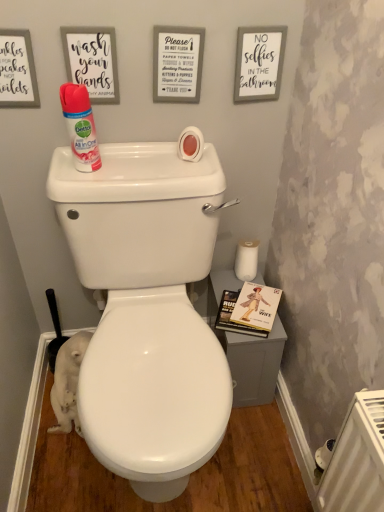
Question: Could white paper sign at upper center, marked as the second copy in a right-to-left arrangement, be considered to be inside matte white sign at upper left, the 3th copy from the right?

Choices:
 (A) no
 (B) yes

Answer: (A)

Question: Considering the relative sizes of matte white sign at upper left, the 2th copy positioned from the left, and white paper sign at upper center, marked as the second copy in a right-to-left arrangement, in the image provided, is matte white sign at upper left, the 2th copy positioned from the left, smaller than white paper sign at upper center, marked as the second copy in a right-to-left arrangement,?

Choices:
 (A) no
 (B) yes

Answer: (B)

Question: Can you confirm if matte white sign at upper left, the 3th copy from the right, is taller than white paper sign at upper center, marked as the second copy in a right-to-left arrangement?

Choices:
 (A) yes
 (B) no

Answer: (B)

Question: Would you say matte white sign at upper left, the 2th copy positioned from the left, is a long distance from white paper sign at upper center, marked as the second copy in a right-to-left arrangement?

Choices:
 (A) yes
 (B) no

Answer: (B)

Question: Is matte white sign at upper left, the 3th copy from the right, looking in the opposite direction of white paper sign at upper center, marked as the second copy in a right-to-left arrangement?

Choices:
 (A) yes
 (B) no

Answer: (B)

Question: From the image's perspective, is matte white sign at upper left, the 2th copy positioned from the left, above white paper sign at upper center, the third copy viewed from the left?

Choices:
 (A) yes
 (B) no

Answer: (B)

Question: Considering the relative positions of white plastic radiator at lower right and white glossy toilet at center in the image provided, is white plastic radiator at lower right in front of white glossy toilet at center?

Choices:
 (A) yes
 (B) no

Answer: (A)

Question: Does white plastic radiator at lower right turn towards white glossy toilet at center?

Choices:
 (A) no
 (B) yes

Answer: (A)

Question: Is white plastic radiator at lower right at the right side of white glossy toilet at center?

Choices:
 (A) no
 (B) yes

Answer: (B)

Question: Is the surface of white plastic radiator at lower right in direct contact with white glossy toilet at center?

Choices:
 (A) yes
 (B) no

Answer: (B)

Question: Is white plastic radiator at lower right outside white glossy toilet at center?

Choices:
 (A) no
 (B) yes

Answer: (B)

Question: Does white plastic radiator at lower right have a lesser height compared to white glossy toilet at center?

Choices:
 (A) no
 (B) yes

Answer: (B)

Question: Could you tell me if white fur cat at lower left is facing matte pink spray can at upper left?

Choices:
 (A) yes
 (B) no

Answer: (B)